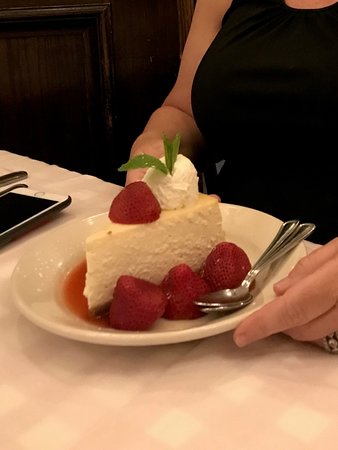
The height and width of the screenshot is (450, 338). Find the location of `spoon`. spoon is located at coordinates (220, 307), (277, 243).